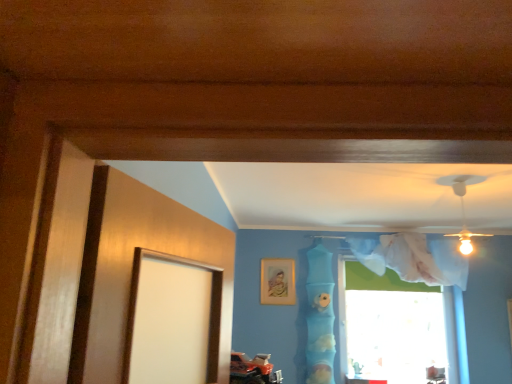
This screenshot has height=384, width=512. I want to click on gold metallic picture frame at upper center, so click(x=278, y=281).

Identify the location of blue fabric at center. Image resolution: width=512 pixels, height=384 pixels. (320, 317).

The height and width of the screenshot is (384, 512). Describe the element at coordinates (320, 317) in the screenshot. I see `blue fabric at center` at that location.

Describe the element at coordinates (395, 332) in the screenshot. I see `transparent fabric at upper right` at that location.

The image size is (512, 384). In order to click on transparent fabric at upper right in this screenshot , I will do `click(395, 332)`.

Locate an element on the screen. Image resolution: width=512 pixels, height=384 pixels. gold metallic picture frame at upper center is located at coordinates (278, 281).

Is transparent fabric at upper right not close to blue fabric at center?

Yes, transparent fabric at upper right and blue fabric at center are quite far apart.

Is transparent fabric at upper right thinner than blue fabric at center?

Indeed, transparent fabric at upper right has a lesser width compared to blue fabric at center.

How much distance is there between transparent fabric at upper right and blue fabric at center?

The distance of transparent fabric at upper right from blue fabric at center is 4.77 feet.

Could you tell me if blue fabric at center is facing gold metallic picture frame at upper center?

No, blue fabric at center is not turned towards gold metallic picture frame at upper center.

From a real-world perspective, is blue fabric at center positioned above or below gold metallic picture frame at upper center?

blue fabric at center is situated lower than gold metallic picture frame at upper center in the real world.

From the image's perspective, is blue fabric at center located above or below gold metallic picture frame at upper center?

Based on their image positions, blue fabric at center is located beneath gold metallic picture frame at upper center.

Where is `picture frame above the transparent fabric at upper right (from the image's perspective)`? picture frame above the transparent fabric at upper right (from the image's perspective) is located at coordinates (278, 281).

From a real-world perspective, is transparent fabric at upper right on gold metallic picture frame at upper center?

Incorrect, from a real-world perspective, transparent fabric at upper right is lower than gold metallic picture frame at upper center.

Could you tell me if transparent fabric at upper right is facing gold metallic picture frame at upper center?

No.

Is transparent fabric at upper right positioned far away from gold metallic picture frame at upper center?

Yes, transparent fabric at upper right and gold metallic picture frame at upper center are located far from each other.

Consider the image. Considering the sizes of objects gold metallic picture frame at upper center and blue fabric at center in the image provided, who is bigger, gold metallic picture frame at upper center or blue fabric at center?

Bigger between the two is blue fabric at center.

Which is closer to the camera, (x=268, y=259) or (x=326, y=316)?

Point (x=268, y=259) appears to be farther away from the viewer than point (x=326, y=316).

From a real-world perspective, which is physically below, gold metallic picture frame at upper center or blue fabric at center?

From a 3D spatial view, blue fabric at center is below.

Could you tell me if gold metallic picture frame at upper center is facing transparent fabric at upper right?

No, gold metallic picture frame at upper center is not facing towards transparent fabric at upper right.

Considering the positions of point (283, 285) and point (382, 297), is point (283, 285) closer or farther from the camera than point (382, 297)?

Point (283, 285) is closer to the camera than point (382, 297).

Which object is positioned more to the right, gold metallic picture frame at upper center or transparent fabric at upper right?

From the viewer's perspective, transparent fabric at upper right appears more on the right side.

Could you tell me if blue fabric at center is turned towards transparent fabric at upper right?

No, blue fabric at center is not oriented towards transparent fabric at upper right.

Consider the image. From the image's perspective, which is above, blue fabric at center or transparent fabric at upper right?

blue fabric at center is shown above in the image.

Which of these two, blue fabric at center or transparent fabric at upper right, is thinner?

transparent fabric at upper right is thinner.

Locate an element on the screen. window behind the blue fabric at center is located at coordinates (395, 332).

Where is `curtain in front of the gold metallic picture frame at upper center`? The image size is (512, 384). curtain in front of the gold metallic picture frame at upper center is located at coordinates (320, 317).

When comparing their distances from blue fabric at center, does gold metallic picture frame at upper center or transparent fabric at upper right seem further?

The object further to blue fabric at center is transparent fabric at upper right.

When comparing their distances from gold metallic picture frame at upper center, does transparent fabric at upper right or blue fabric at center seem closer?

Among the two, blue fabric at center is located nearer to gold metallic picture frame at upper center.

Based on their spatial positions, is blue fabric at center or gold metallic picture frame at upper center closer to transparent fabric at upper right?

blue fabric at center.

When comparing their distances from blue fabric at center, does transparent fabric at upper right or gold metallic picture frame at upper center seem closer?

Based on the image, gold metallic picture frame at upper center appears to be nearer to blue fabric at center.

Considering their positions, is gold metallic picture frame at upper center positioned further to transparent fabric at upper right than blue fabric at center?

gold metallic picture frame at upper center lies further to transparent fabric at upper right than the other object.

From the image, which object appears to be farther from gold metallic picture frame at upper center, blue fabric at center or transparent fabric at upper right?

The object further to gold metallic picture frame at upper center is transparent fabric at upper right.

I want to click on curtain between gold metallic picture frame at upper center and transparent fabric at upper right from left to right, so click(x=320, y=317).